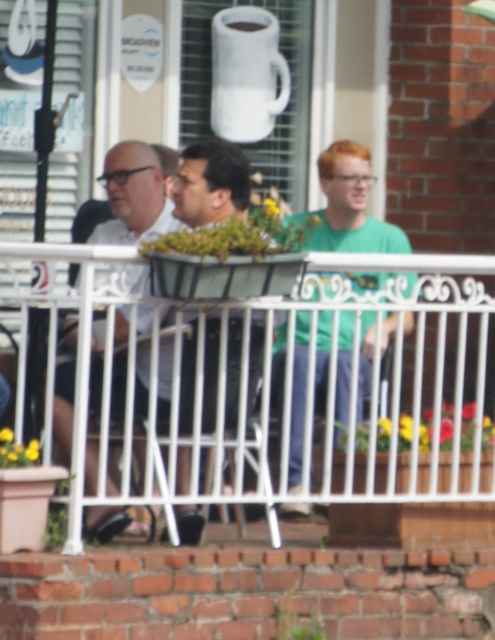
You are standing on the balcony and want to greet the two men wearing the green matte shirt at center and the matte black shirt at center. Which man should you approach first if you want to greet the one closer to the left side?

The matte black shirt at center is to the left of the green matte shirt at center, so you should approach the man wearing the matte black shirt at center first as they are closer to the left side.

You are a photographer trying to capture a closeup of the matte white shirt at center. You notice the white wrought iron railing at center is blocking your view. Can you adjust your position to avoid the railing?

The white wrought iron railing at center is bigger than the matte white shirt at center, so moving your position slightly to the side or adjusting your angle might help avoid the larger railing and focus on the smaller shirt.

You are standing on the balcony and want to place a small potted plant between the white wrought iron railing at center and the matte black shirt at center. Based on their positions, which object should the plant be closer to?

The white wrought iron railing at center is to the right of the matte black shirt at center, so the plant should be placed closer to the matte black shirt at center to be between them.